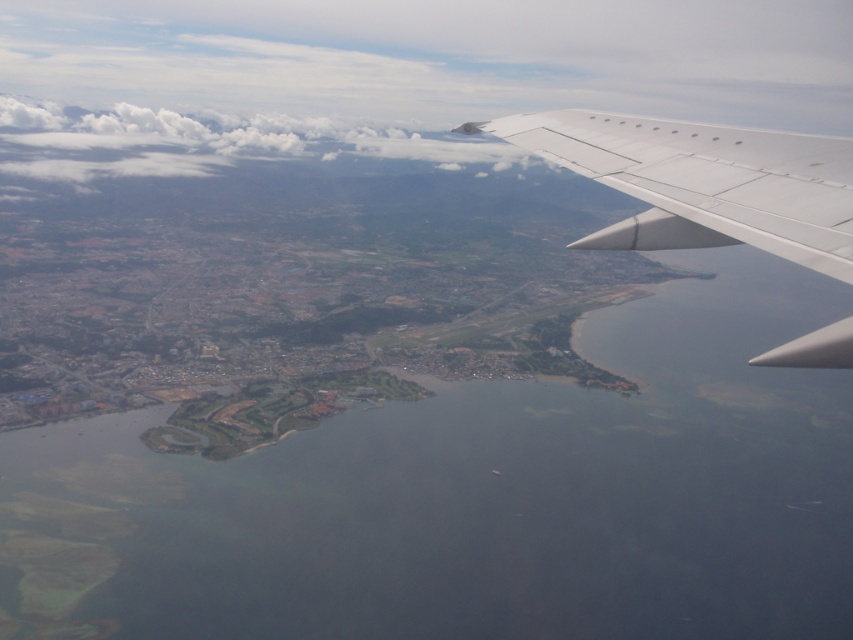
From the picture: Which of these two, white matte wing at upper right or white fluffy cloud at upper left, stands taller?

With more height is white fluffy cloud at upper left.

Between white matte wing at upper right and white fluffy cloud at upper left, which one is positioned lower?

white matte wing at upper right is below.

Which is in front, point (744, 195) or point (97, 125)?

Point (744, 195)

Where is `white matte wing at upper right`? This screenshot has height=640, width=853. white matte wing at upper right is located at coordinates (703, 182).